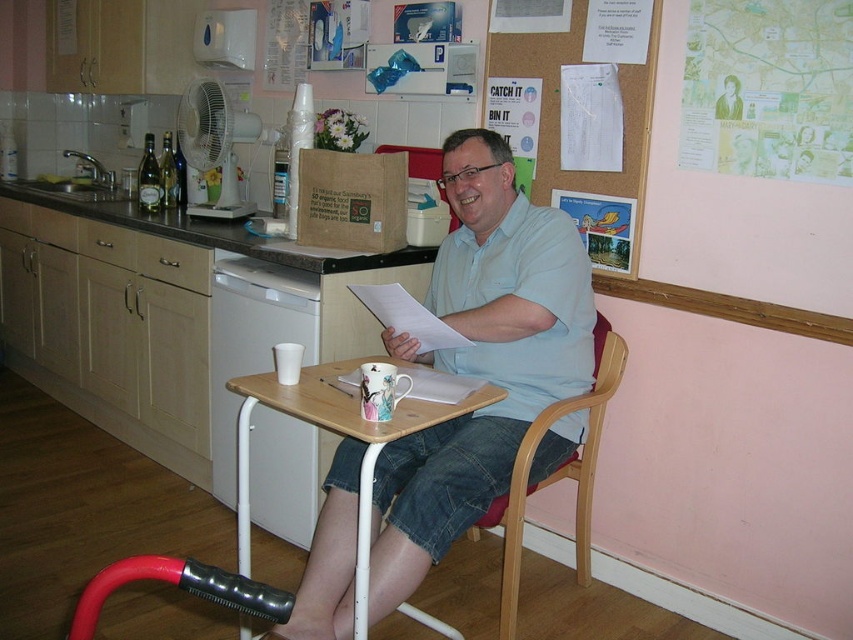
You are trying to place a tall plant that is 1.2 meters in height on the wooden tray at center. Considering the height of the wooden chair at center, will the plant fit on the tray without exceeding the chair height?

The wooden tray at center is shorter than the wooden chair at center. Since the plant is 1.2 meters tall, it would exceed the tray height but may still be placed as long as it doesn

You are standing in the kitchen and want to reach both the light blue cotton shirt at center and the wooden tray at center. Which object will you need to move first to access the other?

The light blue cotton shirt at center is closer to you than the wooden tray at center, so you should move the light blue cotton shirt at center first to access the wooden tray at center.

Looking at this image, what is the exact 2D coordinate position of the light blue cotton shirt at center in the image?

The light blue cotton shirt at center is located at the 2D coordinates point (480, 360).